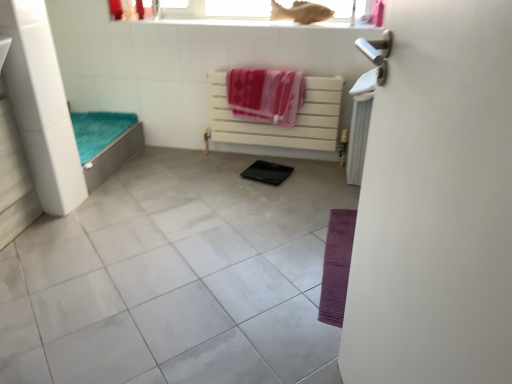
Find the location of a particular element. The height and width of the screenshot is (384, 512). matte plastic fish at upper center is located at coordinates (239, 10).

How much space does pink fabric beach towel at upper right, placed as the 2th beach towel when sorted from left to right, occupy horizontally?

pink fabric beach towel at upper right, placed as the 2th beach towel when sorted from left to right, is 16.60 inches wide.

Identify the location of white plastic radiator at center. (279, 125).

Looking at the image, does pink fabric beach towel at center, which ranks as the second beach towel in right-to-left order, seem bigger or smaller compared to white glossy tile at center?

pink fabric beach towel at center, which ranks as the second beach towel in right-to-left order, is smaller than white glossy tile at center.

Are pink fabric beach towel at center, which ranks as the second beach towel in right-to-left order, and white glossy tile at center beside each other?

pink fabric beach towel at center, which ranks as the second beach towel in right-to-left order, and white glossy tile at center are clearly separated.

Could you measure the distance between pink fabric beach towel at center, acting as the first beach towel starting from the left, and white glossy tile at center?

They are 36.82 inches apart.

Does point (244, 102) come behind point (177, 311)?

That is True.

Which object is more forward, white plastic radiator at center or matte plastic fish at upper center?

Positioned in front is matte plastic fish at upper center.

Can you confirm if white plastic radiator at center is taller than matte plastic fish at upper center?

Indeed, white plastic radiator at center has a greater height compared to matte plastic fish at upper center.

Would you say white plastic radiator at center contains matte plastic fish at upper center?

That's incorrect, matte plastic fish at upper center is not inside white plastic radiator at center.

Is white plastic radiator at center far away from white glossy tile at center?

That's not correct — white plastic radiator at center is a little close to white glossy tile at center.

Is the position of white plastic radiator at center more distant than that of white glossy tile at center?

That is True.

From a real-world perspective, is white plastic radiator at center positioned above or below white glossy tile at center?

From a real-world perspective, white plastic radiator at center is physically above white glossy tile at center.

In the image, is white plastic radiator at center on the left side or the right side of white glossy tile at center?

From the image, it's evident that white plastic radiator at center is to the right of white glossy tile at center.

Is pink fabric beach towel at center, acting as the first beach towel starting from the left, located within white glossy screen door at right?

No, white glossy screen door at right does not contain pink fabric beach towel at center, acting as the first beach towel starting from the left.

Is white glossy screen door at right wider than pink fabric beach towel at center, which ranks as the second beach towel in right-to-left order?

Indeed, white glossy screen door at right has a greater width compared to pink fabric beach towel at center, which ranks as the second beach towel in right-to-left order.

From a real-world perspective, who is located higher, white glossy screen door at right or pink fabric beach towel at center, which ranks as the second beach towel in right-to-left order?

From a 3D spatial view, white glossy screen door at right is above.

Find the location of `screen door in front of the pink fabric beach towel at center, acting as the first beach towel starting from the left`. screen door in front of the pink fabric beach towel at center, acting as the first beach towel starting from the left is located at coordinates (436, 204).

In terms of size, does white glossy tile at center appear bigger or smaller than matte plastic fish at upper center?

Clearly, white glossy tile at center is larger in size than matte plastic fish at upper center.

Would you say white glossy tile at center is inside or outside matte plastic fish at upper center?

white glossy tile at center is not enclosed by matte plastic fish at upper center.

Which is in front, point (305, 336) or point (197, 15)?

The point (305, 336) is more forward.

Is pink fabric beach towel at upper right, positioned as the 1th beach towel in right-to-left order, located outside white plastic radiator at center?

pink fabric beach towel at upper right, positioned as the 1th beach towel in right-to-left order, lies outside white plastic radiator at center's area.

In terms of width, does pink fabric beach towel at upper right, placed as the 2th beach towel when sorted from left to right, look wider or thinner when compared to white plastic radiator at center?

In the image, pink fabric beach towel at upper right, placed as the 2th beach towel when sorted from left to right, appears to be wider than white plastic radiator at center.

Consider the image. From the image's perspective, who appears lower, pink fabric beach towel at upper right, positioned as the 1th beach towel in right-to-left order, or white plastic radiator at center?

white plastic radiator at center.

From a real-world perspective, which object rests below the other?

white plastic radiator at center, from a real-world perspective.

Does white glossy screen door at right have a greater width compared to white plastic radiator at center?

Yes.

Considering the sizes of white glossy screen door at right and white plastic radiator at center in the image, is white glossy screen door at right bigger or smaller than white plastic radiator at center?

white glossy screen door at right is bigger than white plastic radiator at center.

Is white glossy screen door at right in front of or behind white plastic radiator at center in the image?

white glossy screen door at right is in front of white plastic radiator at center.

Is white glossy screen door at right next to white plastic radiator at center and touching it?

white glossy screen door at right is not next to white plastic radiator at center, and they're not touching.

Find the location of a particular element. This screenshot has height=384, width=512. the 2nd beach towel behind the white glossy tile at center, starting your count from the anchor is located at coordinates (266, 95).

The height and width of the screenshot is (384, 512). Find the location of `balustrade on the right side of matte plastic fish at upper center`. balustrade on the right side of matte plastic fish at upper center is located at coordinates (279, 125).

Which object lies nearer to the anchor point white glossy screen door at right, pink fabric beach towel at upper right, positioned as the 1th beach towel in right-to-left order, or white plastic radiator at center?

pink fabric beach towel at upper right, positioned as the 1th beach towel in right-to-left order, lies closer to white glossy screen door at right than the other object.

From the image, which object appears to be nearer to white glossy tile at center, matte plastic fish at upper center or pink fabric beach towel at upper right, positioned as the 1th beach towel in right-to-left order?

The object closer to white glossy tile at center is pink fabric beach towel at upper right, positioned as the 1th beach towel in right-to-left order.

When comparing their distances from white plastic radiator at center, does pink fabric beach towel at center, which ranks as the second beach towel in right-to-left order, or white glossy screen door at right seem closer?

pink fabric beach towel at center, which ranks as the second beach towel in right-to-left order, lies closer to white plastic radiator at center than the other object.

From the image, which object appears to be farther from white plastic radiator at center, white glossy screen door at right or pink fabric beach towel at center, which ranks as the second beach towel in right-to-left order?

white glossy screen door at right is positioned further to the anchor white plastic radiator at center.

Which object lies nearer to the anchor point white glossy tile at center, pink fabric beach towel at center, acting as the first beach towel starting from the left, or matte plastic fish at upper center?

Based on the image, pink fabric beach towel at center, acting as the first beach towel starting from the left, appears to be nearer to white glossy tile at center.

Considering their positions, is pink fabric beach towel at upper right, positioned as the 1th beach towel in right-to-left order, positioned further to pink fabric beach towel at center, which ranks as the second beach towel in right-to-left order, than matte plastic fish at upper center?

pink fabric beach towel at upper right, positioned as the 1th beach towel in right-to-left order, is positioned further to the anchor pink fabric beach towel at center, which ranks as the second beach towel in right-to-left order.

Which object lies further to the anchor point matte plastic fish at upper center, white glossy tile at center or pink fabric beach towel at center, acting as the first beach towel starting from the left?

white glossy tile at center is positioned further to the anchor matte plastic fish at upper center.

Estimate the real-world distances between objects in this image. Which object is closer to matte plastic fish at upper center, white glossy screen door at right or white glossy tile at center?

The object closer to matte plastic fish at upper center is white glossy tile at center.

Image resolution: width=512 pixels, height=384 pixels. In order to click on beach towel between matte plastic fish at upper center and pink fabric beach towel at upper right, placed as the 2th beach towel when sorted from left to right, from left to right in this screenshot , I will do `click(266, 95)`.

You are a GUI agent. You are given a task and a screenshot of the screen. Output one action in this format:
    pyautogui.click(x=<x>, y=<y>)
    Task: Click on the ceramic tile located between white glossy screen door at right and pink fabric beach towel at center, acting as the first beach towel starting from the left, in the depth direction
    The height and width of the screenshot is (384, 512).
    Given the screenshot: What is the action you would take?
    pyautogui.click(x=176, y=278)

This screenshot has width=512, height=384. In order to click on balustrade between pink fabric beach towel at center, acting as the first beach towel starting from the left, and pink fabric beach towel at upper right, placed as the 2th beach towel when sorted from left to right, in the horizontal direction in this screenshot , I will do `click(279, 125)`.

Locate an element on the screen. window between white glossy tile at center and white plastic radiator at center along the z-axis is located at coordinates click(x=239, y=10).